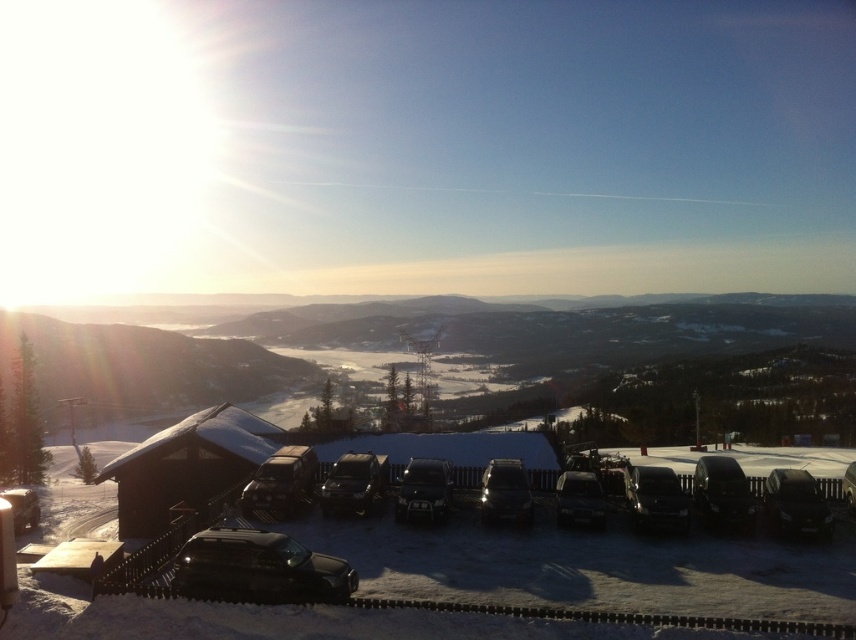
Does black matte cars at center appear under shiny black car at center?

Yes.

Locate an element on the screen. The height and width of the screenshot is (640, 856). black matte cars at center is located at coordinates (587, 563).

Does point (842, 525) come in front of point (819, 499)?

No.

At what (x,y) coordinates should I click in order to perform the action: click on black matte cars at center. Please return your answer as a coordinate pair (x, y). This screenshot has width=856, height=640. Looking at the image, I should click on (587, 563).

Between point (765, 579) and point (355, 509), which one is positioned behind?

The point (355, 509) is more distant.

Between point (705, 612) and point (342, 502), which one is positioned in front?

Point (705, 612) is more forward.

This screenshot has width=856, height=640. Find the location of `black matte cars at center`. black matte cars at center is located at coordinates (587, 563).

Is glossy black suv at lower center smaller than metallic silver car at center?

Indeed, glossy black suv at lower center has a smaller size compared to metallic silver car at center.

Is point (284, 580) farther from viewer compared to point (854, 500)?

No, (284, 580) is in front of (854, 500).

Where is `glossy black suv at lower center`? This screenshot has width=856, height=640. glossy black suv at lower center is located at coordinates (259, 568).

Identify the location of glossy black suv at lower center. (259, 568).